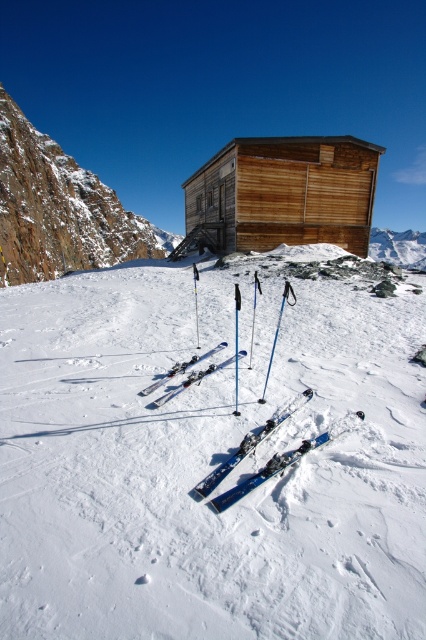
Question: Which point is farther to the camera?

Choices:
 (A) blue glossy ski pole at center
 (B) blue metallic ski pole at center
 (C) shiny blue skis at center

Answer: (B)

Question: Can you confirm if rugged stone mountain at upper left is smaller than blue glossy ski pole at center?

Choices:
 (A) yes
 (B) no

Answer: (B)

Question: Can you confirm if wooden cabin at center is wider than shiny black skis at center?

Choices:
 (A) no
 (B) yes

Answer: (B)

Question: Based on their relative distances, which object is farther from the shiny metallic skis at center?

Choices:
 (A) shiny black skis at center
 (B) shiny blue skis at center
 (C) rugged stone mountain at upper left
 (D) blue glossy ski pole at center

Answer: (C)

Question: Which object is positioned farthest from the blue metallic ski pole at center?

Choices:
 (A) shiny black skis at center
 (B) shiny blue skis at center
 (C) wooden cabin at center
 (D) rugged stone mountain at upper left

Answer: (D)

Question: Does wooden cabin at center appear under blue glossy ski pole at center?

Choices:
 (A) yes
 (B) no

Answer: (B)